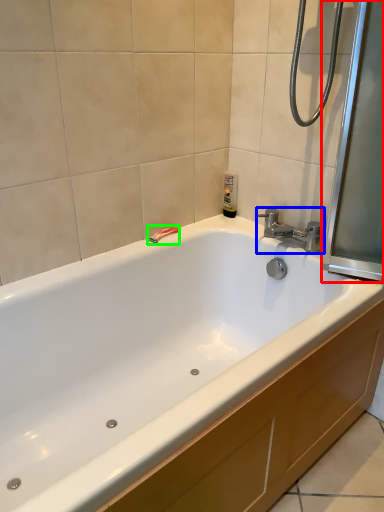
Question: Considering the real-world distances, which object is closest to screen door (highlighted by a red box)? tap (highlighted by a blue box) or shower (highlighted by a green box).

Choices:
 (A) tap
 (B) shower

Answer: (A)